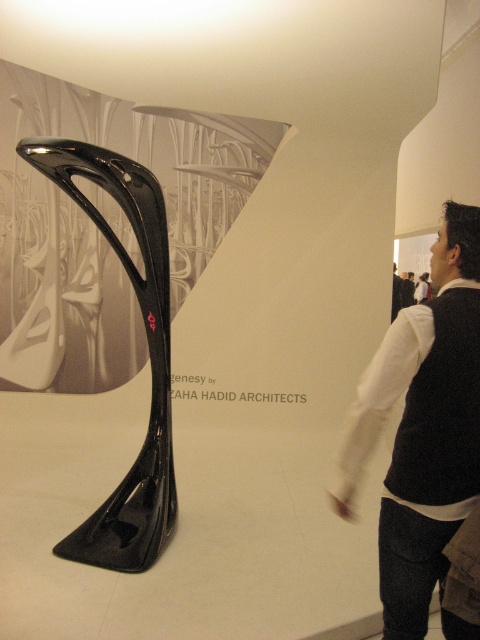
You are an art curator planning to install a new light fixture in the exhibition space. The light fixture will be placed at point (422, 428). What object is located at this coordinate?

The black fabric vest at center is located at point (422, 428).

You are an art curator arranging an exhibition. You need to place a label next to the black fabric vest at center so visitors can read it while looking at the sculpture. Where should you position the label relative to the glossy carbon fiber sculpture at center?

The black fabric vest at center is below the glossy carbon fiber sculpture at center, so the label should be placed below the sculpture to ensure visitors can read it while viewing the sculpture.

You are an event planner setting up a photo shoot in the exhibition space. You need to position a camera at a specific coordinate to capture the black fabric vest at center. What are the coordinates where you should place the camera to ensure the vest is in the center of the photo?

The coordinates for the black fabric vest at center are at point [422,428]. To center the vest in the photo, the camera should be positioned at those coordinates.